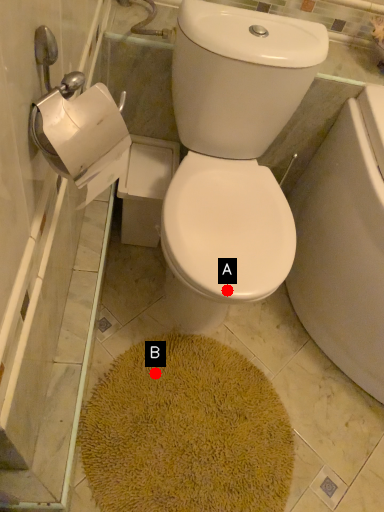
Question: Two points are circled on the image, labeled by A and B beside each circle. Which of the following is the farthest from the observer?

Choices:
 (A) A is further
 (B) B is further

Answer: (B)